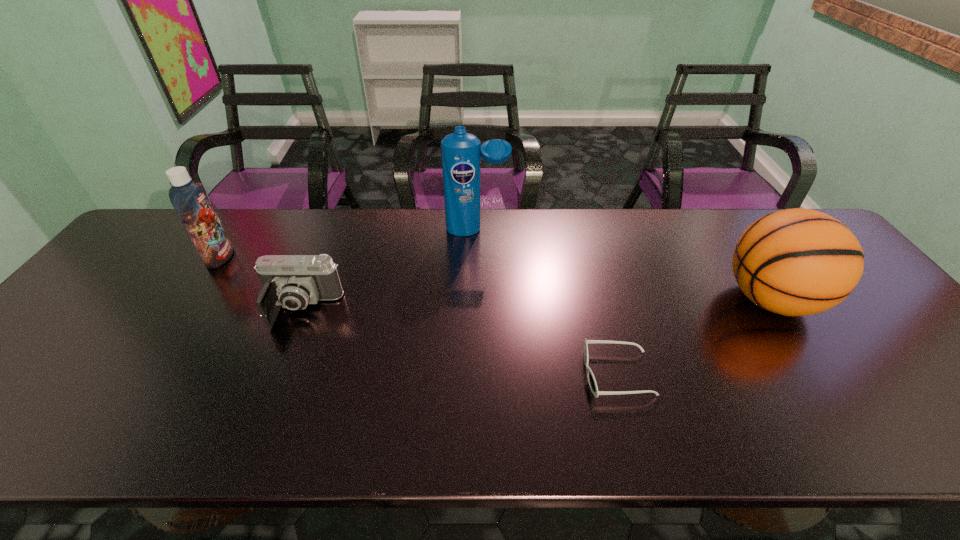
The height and width of the screenshot is (540, 960). I want to click on vacant space located on the front label of the leftmost object, so click(297, 257).

Locate an element on the screen. This screenshot has height=540, width=960. vacant position located 0.250m on the back of the basketball is located at coordinates (715, 216).

Find the location of a particular element. The height and width of the screenshot is (540, 960). free space located at the front of the second shortest object with an open lens cover is located at coordinates (277, 368).

The height and width of the screenshot is (540, 960). Identify the location of free location located with the lenses of the nearest object facing outward. click(x=553, y=374).

Locate an element on the screen. vacant area located 0.200m with the lenses of the nearest object facing outward is located at coordinates (495, 374).

Locate an element on the screen. vacant space located 0.300m with the lenses of the nearest object facing outward is located at coordinates (451, 374).

The image size is (960, 540). In order to click on object at the right edge in this screenshot , I will do point(794,262).

In order to click on vacant space at the far edge of the desktop in this screenshot , I will do `click(483, 254)`.

In the image, there is a desktop. What are the coordinates of `free space at the near edge` in the screenshot? It's located at (318, 435).

Where is `vacant space at the left edge of the desktop`? vacant space at the left edge of the desktop is located at coordinates (134, 293).